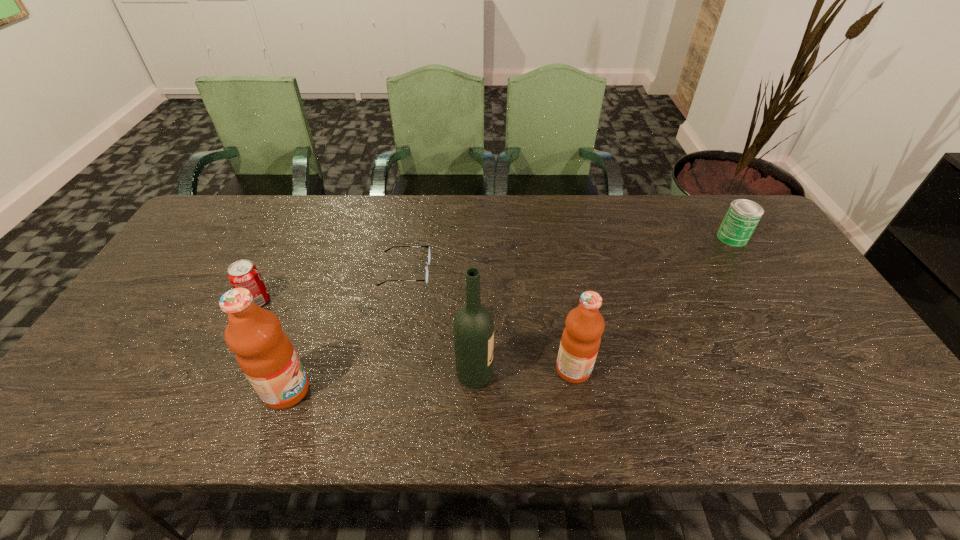
Please point out where to position a new fruit juice on the right to maintain spacing. Please provide its 2D coordinates. Your answer should be formatted as a tuple, i.e. [(x, y)], where the tuple contains the x and y coordinates of a point satisfying the conditions above.

[(839, 350)]